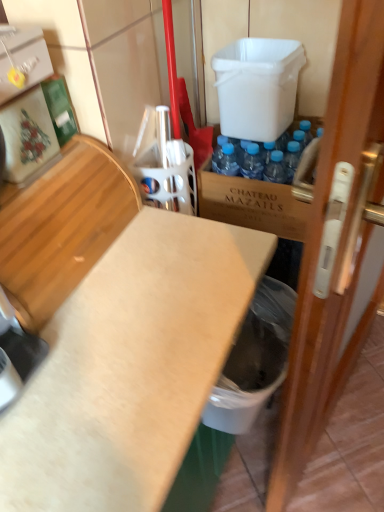
This screenshot has width=384, height=512. I want to click on vacant area that lies to the right of light brown wood at left, so click(169, 265).